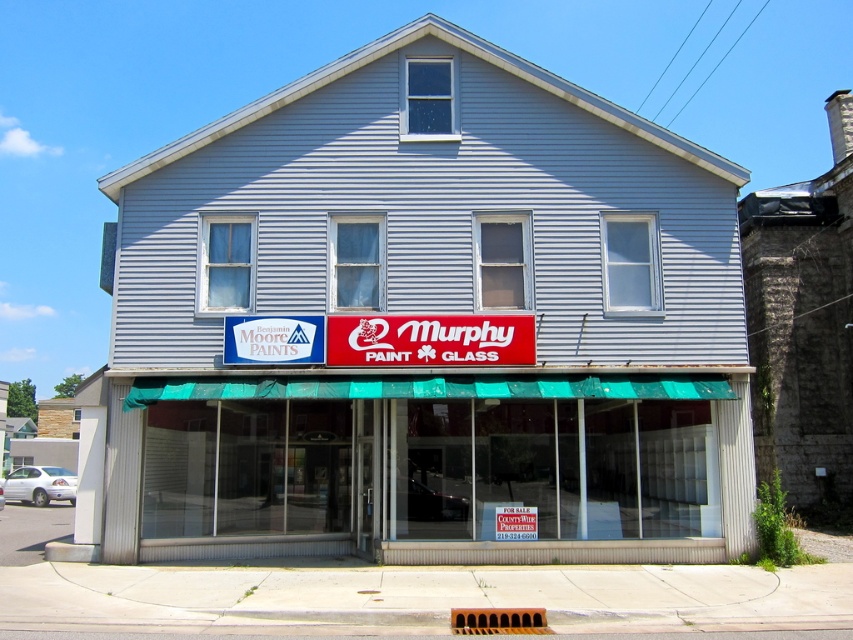
You are a delivery person trying to find the entrance to Murphy Paint and Glass. You see a green awning at center and a red plastic sign at center. Which object is higher up and can help you locate the entrance?

The green awning at center is taller than the red plastic sign at center, so the green awning at center is higher up and can help locate the entrance.

You are standing in front of the two story building and want to know which of the two points, point (550, 97) or point (358, 348), is closer to you. Which one is closer?

Point (358, 348) is closer to you because it is less further to the camera than point (550, 97).

You are a delivery person who needs to park your truck that is 6 meters long. You see the gray siding building at center and the green awning at center. Can you fit your truck between them?

The gray siding building at center is 66.85 centimeters away from the green awning at center. Since the truck is 6 meters long, which is much longer than the distance between the two objects, the truck cannot fit between them.